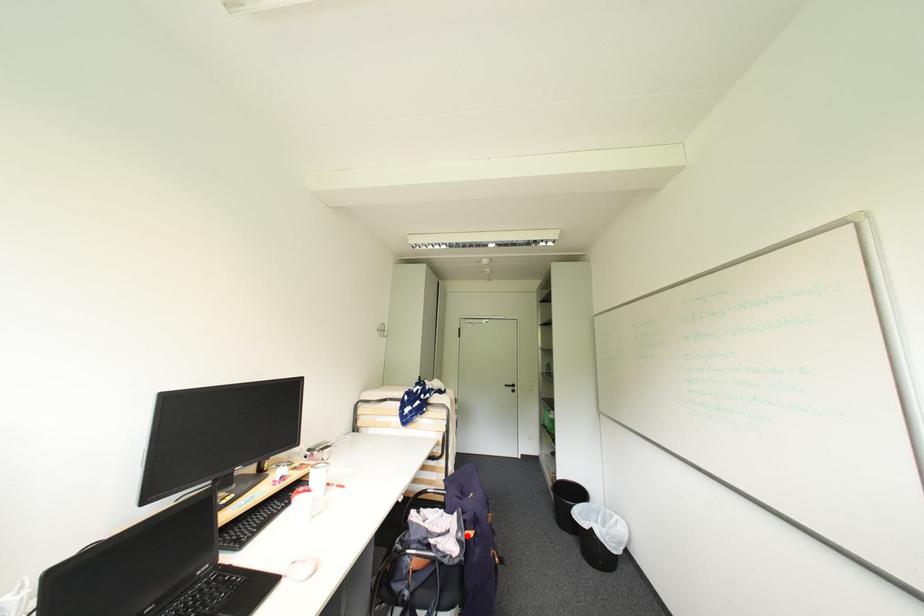
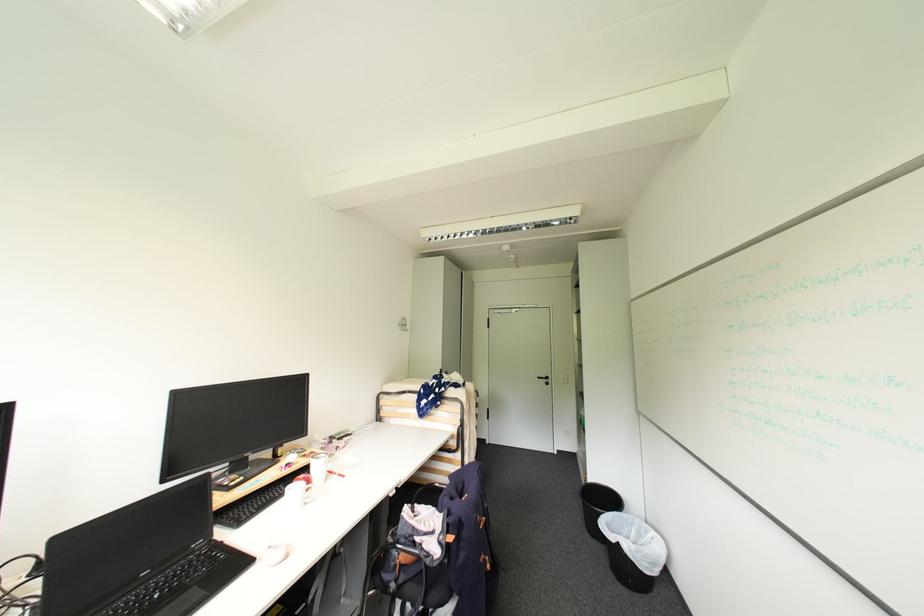
In the second image, find the point that corresponds to the highlighted location in the first image.

(447, 538)